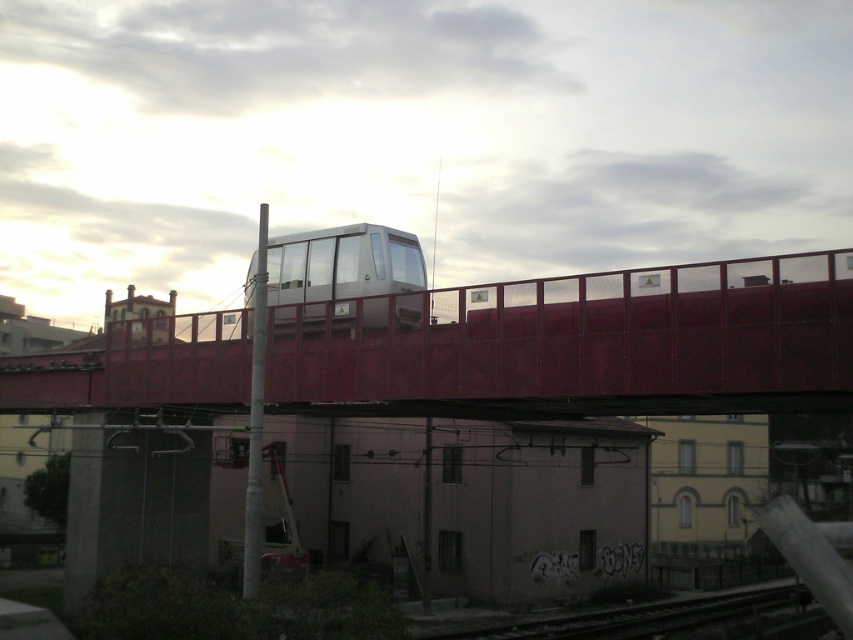
Can you confirm if metallic silver train at center is thinner than metallic train track at lower center?

Indeed, metallic silver train at center has a lesser width compared to metallic train track at lower center.

The image size is (853, 640). What are the coordinates of `metallic silver train at center` in the screenshot? It's located at (341, 262).

Is point (350, 278) closer to viewer compared to point (740, 614)?

Yes, it is in front of point (740, 614).

You are a GUI agent. You are given a task and a screenshot of the screen. Output one action in this format:
    pyautogui.click(x=<x>, y=<y>)
    Task: Click on the metallic silver train at center
    The height and width of the screenshot is (640, 853).
    Given the screenshot: What is the action you would take?
    pyautogui.click(x=341, y=262)

Does metallic red bridge at center appear over metallic train track at lower center?

Yes.

Is point (505, 413) positioned before point (648, 605)?

That is True.

Between point (581, 348) and point (752, 624), which one is positioned behind?

Point (752, 624)

The height and width of the screenshot is (640, 853). I want to click on metallic red bridge at center, so click(x=579, y=344).

Can you confirm if metallic red bridge at center is smaller than metallic silver train at center?

Actually, metallic red bridge at center might be larger than metallic silver train at center.

Measure the distance between metallic red bridge at center and camera.

A distance of 14.99 meters exists between metallic red bridge at center and camera.

Between point (105, 369) and point (254, 292), which one is positioned behind?

Positioned behind is point (105, 369).

You are a GUI agent. You are given a task and a screenshot of the screen. Output one action in this format:
    pyautogui.click(x=<x>, y=<y>)
    Task: Click on the metallic red bridge at center
    
    Given the screenshot: What is the action you would take?
    pyautogui.click(x=579, y=344)